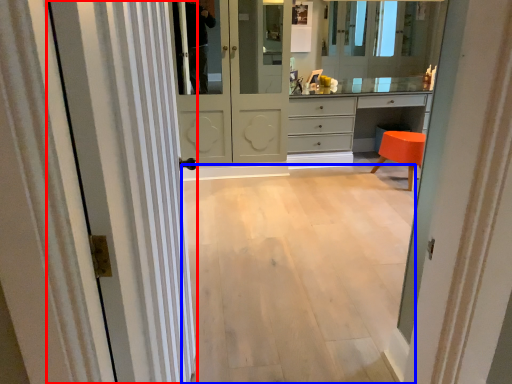
Question: Which object appears farthest to the camera in this image, door (highlighted by a red box) or corridor (highlighted by a blue box)?

Choices:
 (A) door
 (B) corridor

Answer: (B)